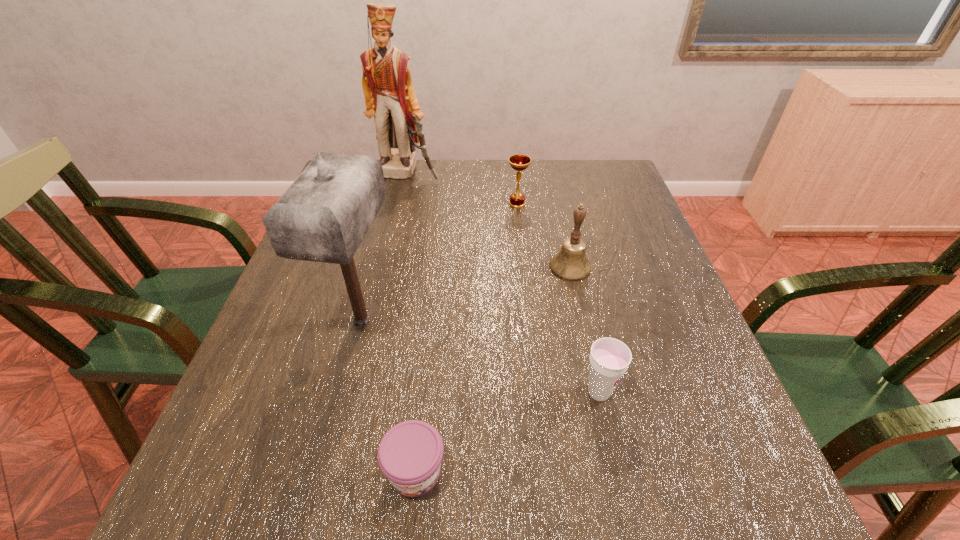
Where is `vacant space that satisfies the following two spatial constraints: 1. on the front-facing side of the tallest object; 2. on the left side of the fifth farthest object`? vacant space that satisfies the following two spatial constraints: 1. on the front-facing side of the tallest object; 2. on the left side of the fifth farthest object is located at coordinates (355, 393).

The image size is (960, 540). What are the coordinates of `vacant space that satisfies the following two spatial constraints: 1. on the front-facing side of the nutcracker; 2. on the right side of the fifth tallest object` in the screenshot? It's located at pos(355,393).

In order to click on vacant space that satisfies the following two spatial constraints: 1. on the front-facing side of the fourth shortest object; 2. on the left side of the farthest object in this screenshot , I will do `click(385, 267)`.